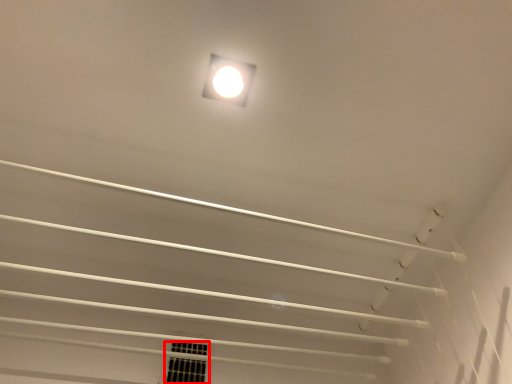
Question: From the image's perspective, considering the relative positions of window (annotated by the red box) and lamp in the image provided, where is window (annotated by the red box) located with respect to the staircase?

Choices:
 (A) below
 (B) above

Answer: (A)